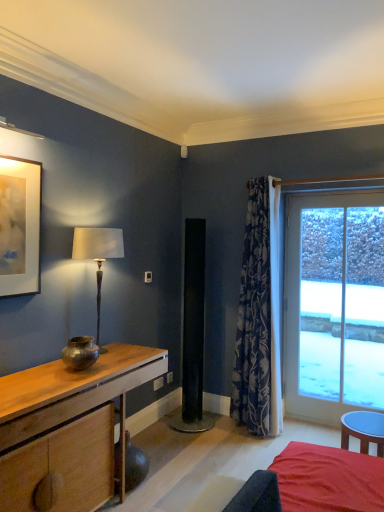
Question: Is the depth of wooden desk at left less than that of velvet red bed at lower right?

Choices:
 (A) no
 (B) yes

Answer: (A)

Question: Is wooden desk at left at the left side of velvet red bed at lower right?

Choices:
 (A) yes
 (B) no

Answer: (A)

Question: Can you confirm if wooden desk at left is taller than velvet red bed at lower right?

Choices:
 (A) no
 (B) yes

Answer: (B)

Question: Would you say wooden desk at left is a long distance from velvet red bed at lower right?

Choices:
 (A) yes
 (B) no

Answer: (A)

Question: Would you say wooden desk at left is outside velvet red bed at lower right?

Choices:
 (A) yes
 (B) no

Answer: (A)

Question: Is point (258, 393) positioned closer to the camera than point (345, 239)?

Choices:
 (A) farther
 (B) closer

Answer: (B)

Question: Is blue floral fabric curtain at right to the left or to the right of transparent glass door at right in the image?

Choices:
 (A) right
 (B) left

Answer: (B)

Question: In terms of size, does blue floral fabric curtain at right appear bigger or smaller than transparent glass door at right?

Choices:
 (A) small
 (B) big

Answer: (B)

Question: In terms of height, does blue floral fabric curtain at right look taller or shorter compared to transparent glass door at right?

Choices:
 (A) tall
 (B) short

Answer: (A)

Question: Is point (11, 172) closer or farther from the camera than point (69, 344)?

Choices:
 (A) closer
 (B) farther

Answer: (A)

Question: Looking at the image, does matte gold picture frame at upper left seem bigger or smaller compared to bronze metallic vase at left?

Choices:
 (A) small
 (B) big

Answer: (B)

Question: In the image, is matte gold picture frame at upper left positioned in front of or behind bronze metallic vase at left?

Choices:
 (A) front
 (B) behind

Answer: (A)

Question: From a real-world perspective, is matte gold picture frame at upper left physically located above or below bronze metallic vase at left?

Choices:
 (A) below
 (B) above

Answer: (B)

Question: Considering the positions of matte bronze lamp at left and bronze metallic vase at left in the image, is matte bronze lamp at left taller or shorter than bronze metallic vase at left?

Choices:
 (A) short
 (B) tall

Answer: (B)

Question: Is matte bronze lamp at left bigger or smaller than bronze metallic vase at left?

Choices:
 (A) small
 (B) big

Answer: (B)